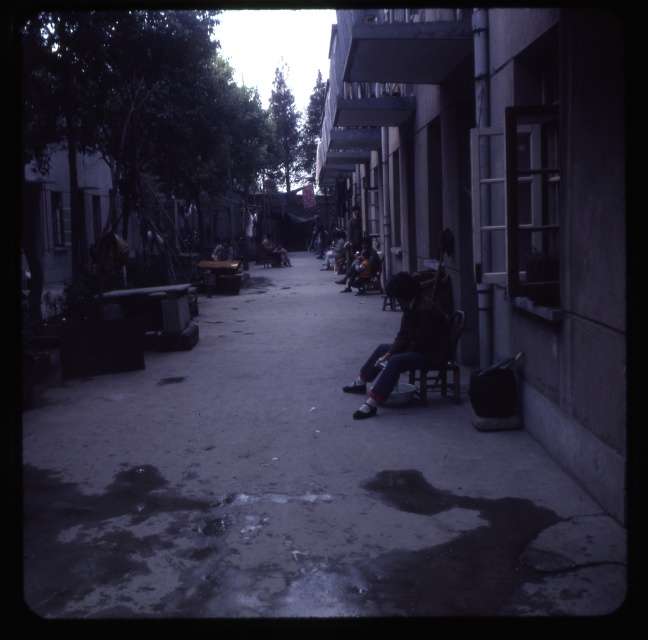
You are standing at the entrance of the alley and want to walk to the smooth concrete pavement at center. Which direction should you walk to reach it?

Since the smooth concrete pavement at center is located at point [294,483] in the image, you should walk forward towards the center of the alley to reach it.

You are a delivery person with a cart that is 1.5 meters wide. You need to navigate through the narrow alleyway shown in the image. The alley has a smooth concrete pavement at center and a dark brown leather jacket at center. Can your cart pass through the space between these two objects?

The smooth concrete pavement at center is 1.61 meters from the dark brown leather jacket at center. Since your cart is 1.5 meters wide, it can pass through the space between them as the distance is slightly wider than the cart.